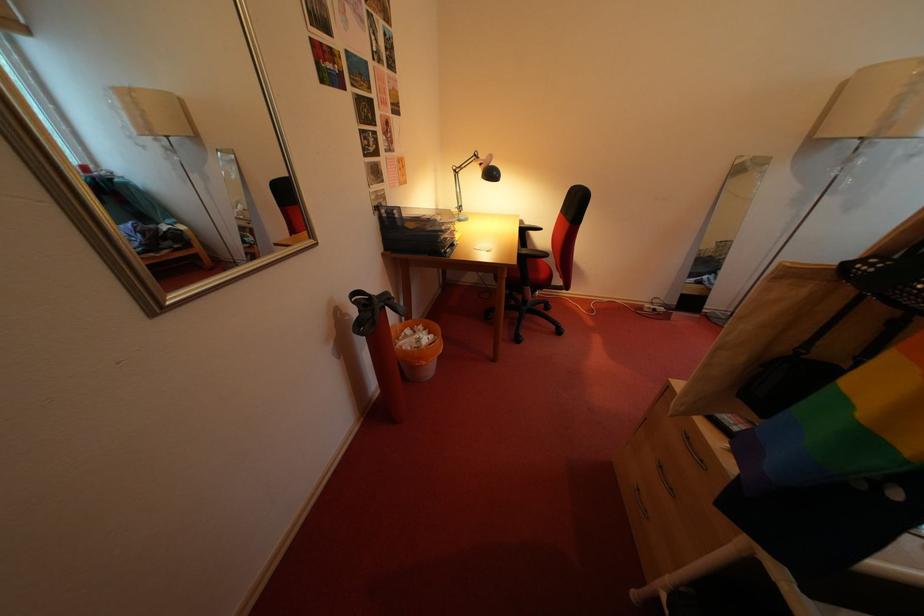
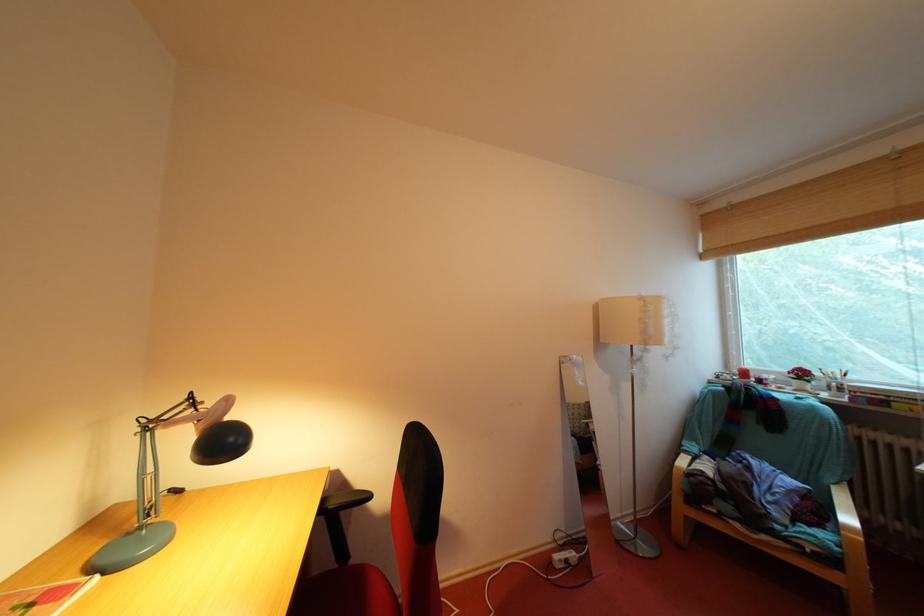
How did the camera likely rotate?

The rotation direction of the camera is right-up.